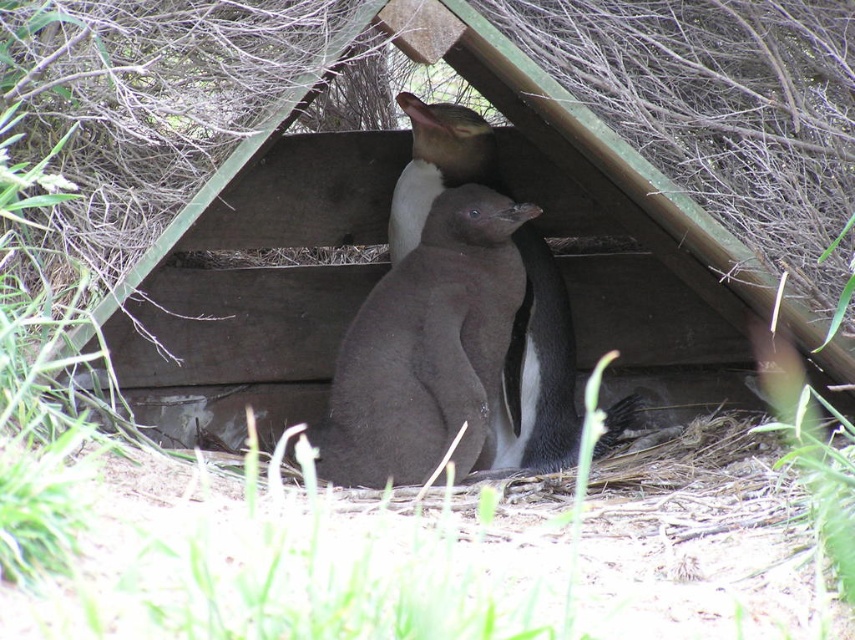
Question: Among these objects, which one is farthest from the camera?

Choices:
 (A) dark gray feathers at center
 (B) brown fuzzy penguin at center

Answer: (B)

Question: Which point is farther to the camera?

Choices:
 (A) brown fuzzy penguin at center
 (B) dark gray feathers at center
 (C) dark gray matte penguin at center

Answer: (A)

Question: Which of the following is the farthest from the observer?

Choices:
 (A) dark gray matte penguin at center
 (B) brown fuzzy penguin at center
 (C) dark gray feathers at center

Answer: (B)

Question: Is dark gray matte penguin at center to the right of dark gray feathers at center from the viewer's perspective?

Choices:
 (A) no
 (B) yes

Answer: (A)

Question: Does dark gray feathers at center have a smaller size compared to brown fuzzy penguin at center?

Choices:
 (A) yes
 (B) no

Answer: (B)

Question: Can you confirm if dark gray feathers at center is wider than brown fuzzy penguin at center?

Choices:
 (A) yes
 (B) no

Answer: (A)